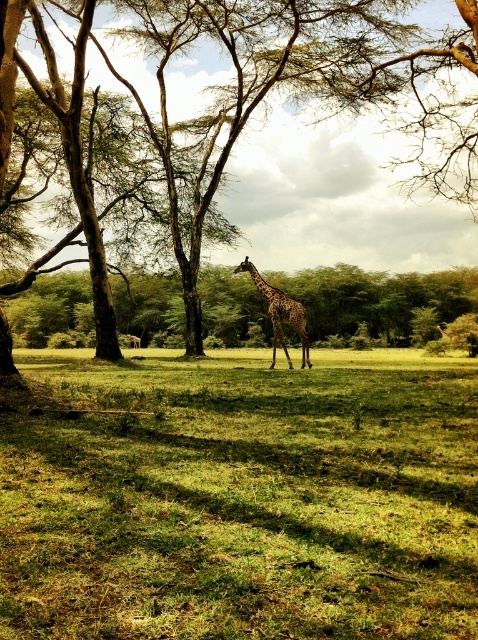
You are a wildlife photographer aiming to capture the spotted fur giraffe at center against the backdrop of the brown textured tree at upper left. Given their sizes, will the giraffe be mostly visible in the photo?

The brown textured tree at upper left is bigger than the spotted fur giraffe at center, so the giraffe will be mostly visible as the tree is larger and can provide a suitable backdrop without obstructing the giraffe.

You are a wildlife photographer planning to capture a wide shot of the savanna. You have a camera that can focus on objects within a 100m width. Given the green grassy field at center and the brown textured tree at upper left, which object would require you to adjust your camera settings for a closer focus?

The green grassy field at center requires adjusting the camera settings for a closer focus because its width is less than the brown textured tree at upper left, meaning it is closer to the camera.

You are standing at the point marked as point (x=241, y=499) in the savanna scene. Based on the description, what type of terrain are you currently standing on?

The point (x=241, y=499) is on the green grassy field at center, so you are standing on green grassy terrain.